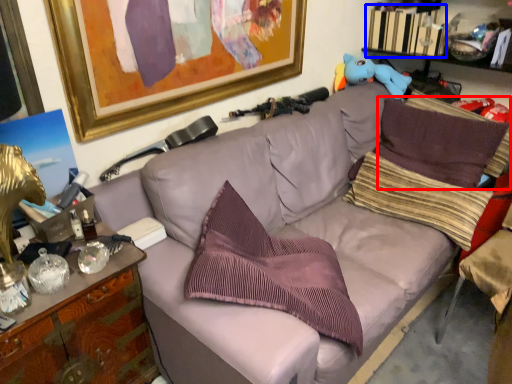
Question: Which object appears farthest to the camera in this image, pillow (highlighted by a red box) or book (highlighted by a blue box)?

Choices:
 (A) pillow
 (B) book

Answer: (B)